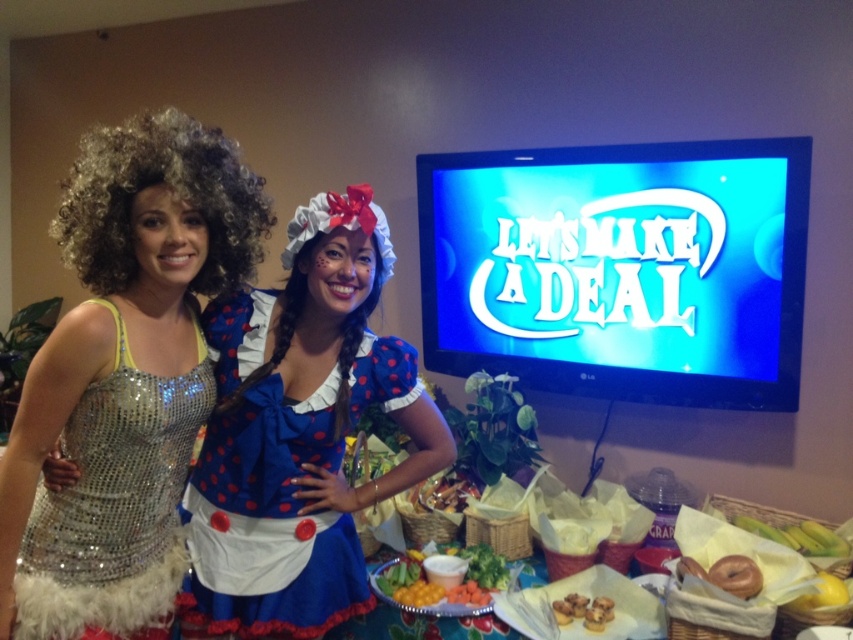
Question: Which object appears farthest from the camera in this image?

Choices:
 (A) sparkly silver dress at left
 (B) shiny sequined dress at left
 (C) yellow banana at lower right

Answer: (C)

Question: Which point is closer to the camera?

Choices:
 (A) shiny sequined dress at left
 (B) sparkly silver dress at left

Answer: (A)

Question: Observing the image, what is the correct spatial positioning of shiny sequined dress at left in reference to blue polka dot fabric dress at center?

Choices:
 (A) below
 (B) above

Answer: (B)

Question: Where is shiny sequined dress at left located in relation to vibrant orange carrot at center in the image?

Choices:
 (A) above
 (B) below

Answer: (A)

Question: Estimate the real-world distances between objects in this image. Which object is closer to the sparkly silver dress at left?

Choices:
 (A) shiny sequined dress at left
 (B) blue polka dot fabric dress at center

Answer: (A)

Question: Is shiny sequined dress at left to the left of golden brown muffins at lower center from the viewer's perspective?

Choices:
 (A) no
 (B) yes

Answer: (B)